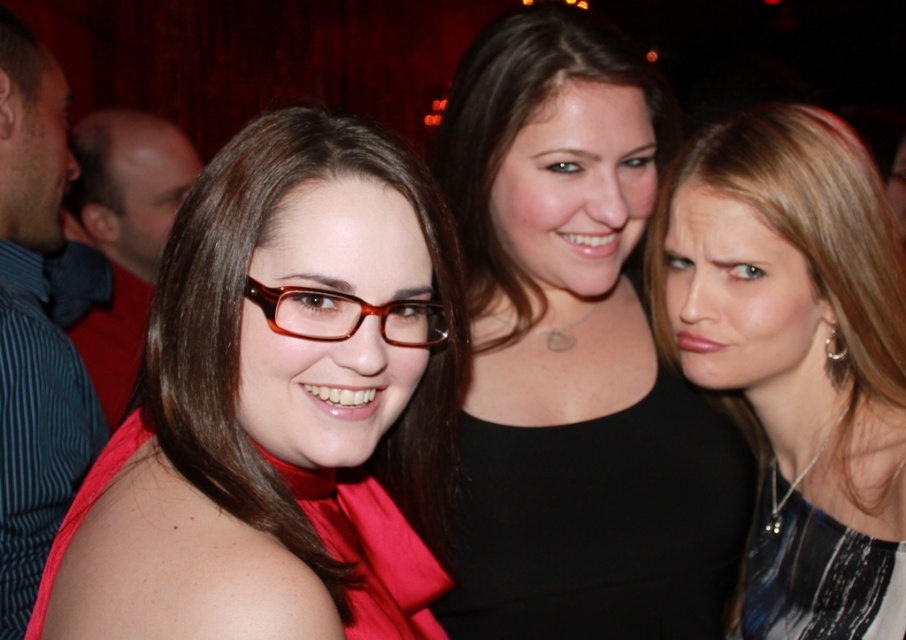
You are a photographer trying to capture a closeup of the black matte dress at center and the brown glossy glasses at center. Which object is wider when viewed from your camera lens?

The black matte dress at center is wider than the brown glossy glasses at center.

You are a photographer trying to capture a closeup of the woman on the left. You notice two points in the scene marked as point 1 at coordinates point (297, 612) and point 2 at coordinates point (641, 84). Which point should you focus on to ensure the woman on the left is in sharp focus?

You should focus on point 1 at coordinates point (297, 612) because it is closer to the camera than point 2 at coordinates point (641, 84), ensuring the woman on the left is in focus.

You are holding a camera and want to take a closeup photo of the matte red glasses at center. The camera lens has a minimum focusing distance of 20 inches. Can you take the photo without moving the glasses?

The matte red glasses at center and viewer are 21.92 inches apart from each other. Since the minimum focusing distance is 20 inches, the camera can focus at 21.92 inches, so yes, you can take the closeup photo without moving the glasses.